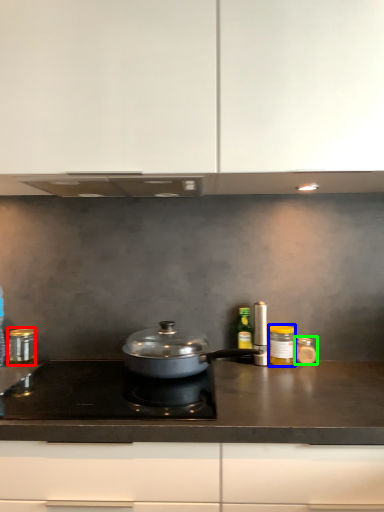
Question: Which object is positioned closest to kitchen appliance (highlighted by a red box)? Select from kitchen appliance (highlighted by a blue box) and kitchen appliance (highlighted by a green box).

Choices:
 (A) kitchen appliance
 (B) kitchen appliance

Answer: (A)